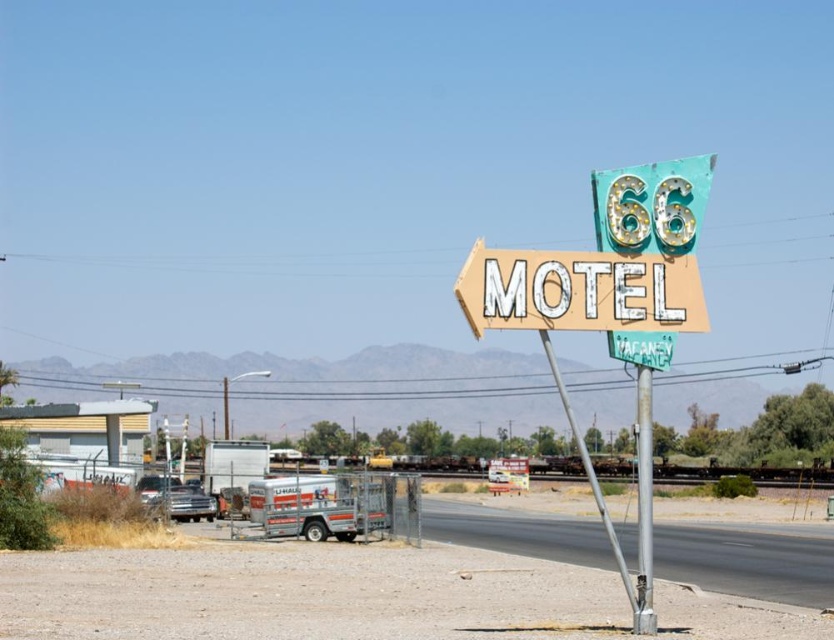
Question: Can you confirm if vintage neon motel sign at center is thinner than green neon motel sign at center?

Choices:
 (A) yes
 (B) no

Answer: (B)

Question: Which of the following is the closest to the observer?

Choices:
 (A) vintage neon motel sign at center
 (B) green neon motel sign at center

Answer: (A)

Question: Which point is farther to the camera?

Choices:
 (A) (556, 300)
 (B) (623, 336)

Answer: (B)

Question: Does vintage neon motel sign at center have a greater width compared to metallic pole at center?

Choices:
 (A) no
 (B) yes

Answer: (A)

Question: Which object is closer to the camera taking this photo?

Choices:
 (A) vintage neon motel sign at center
 (B) green neon motel sign at center
 (C) metallic pole at center

Answer: (C)

Question: Is metallic pole at center wider than green neon motel sign at center?

Choices:
 (A) no
 (B) yes

Answer: (B)